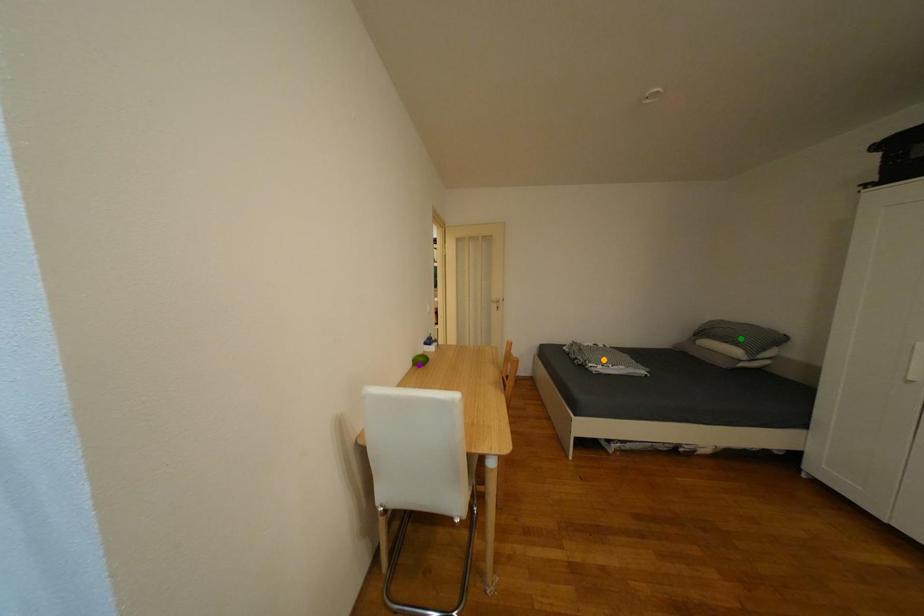
Order these from nearest to farthest:
green point
orange point
purple point

purple point
green point
orange point